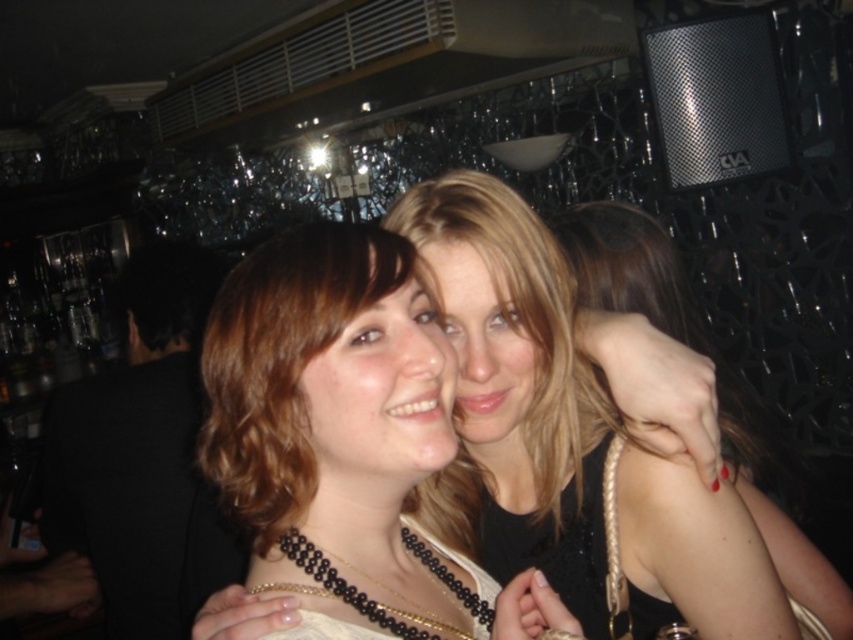
Question: Which point is closer to the camera?

Choices:
 (A) (202, 502)
 (B) (445, 579)
 (C) (563, 483)

Answer: (B)

Question: Estimate the real-world distances between objects in this image. Which object is closer to the black beaded necklace at center?

Choices:
 (A) smooth blonde hair at center
 (B) blonde hair at center
 (C) smooth brown hair at center

Answer: (B)

Question: Is smooth brown hair at center smaller than blonde hair at center?

Choices:
 (A) no
 (B) yes

Answer: (A)

Question: Is smooth blonde hair at center positioned behind black beaded necklace at center?

Choices:
 (A) yes
 (B) no

Answer: (A)

Question: Which point is farther to the camera?

Choices:
 (A) (113, 625)
 (B) (581, 476)
 (C) (219, 422)

Answer: (A)

Question: Does smooth blonde hair at center have a lesser width compared to smooth brown hair at center?

Choices:
 (A) yes
 (B) no

Answer: (A)